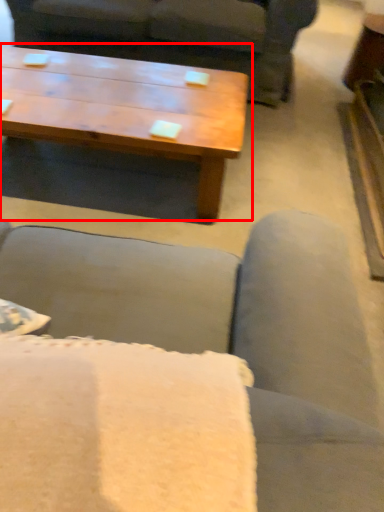
Question: From the image's perspective, what is the correct spatial positioning of coffee table (annotated by the red box) in reference to studio couch?

Choices:
 (A) below
 (B) above

Answer: (A)